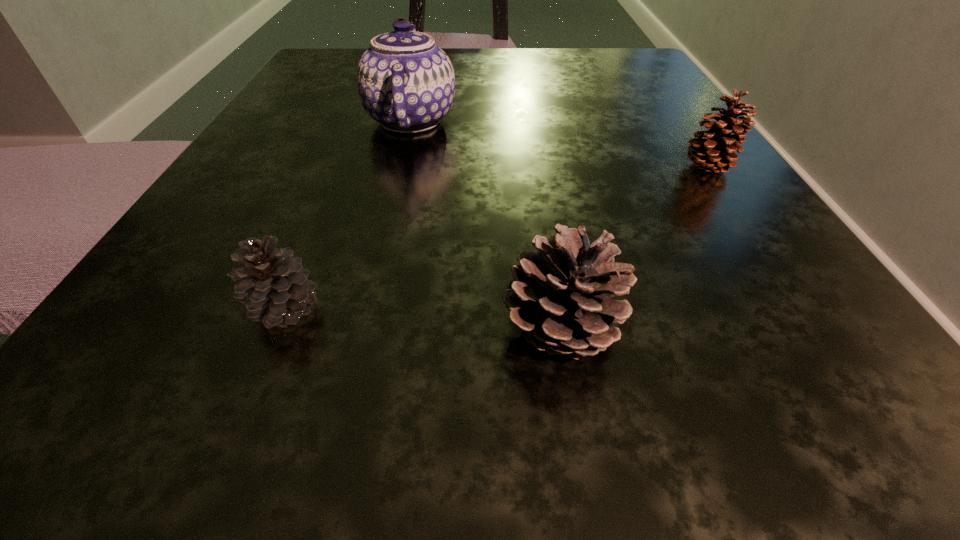
What are the coordinates of `object that is at the far edge` in the screenshot? It's located at (406, 83).

Identify the location of object located at the near edge. Image resolution: width=960 pixels, height=540 pixels. (561, 296).

This screenshot has width=960, height=540. Find the location of `chinaware positioned at the left edge`. chinaware positioned at the left edge is located at coordinates (406, 83).

Find the location of a particular element. The width and height of the screenshot is (960, 540). pinecone that is at the left edge is located at coordinates [274, 287].

Identify the location of object present at the right edge. The height and width of the screenshot is (540, 960). (717, 153).

The image size is (960, 540). I want to click on object that is at the far left corner, so point(406,83).

Locate an element on the screen. vacant space at the far edge of the desktop is located at coordinates tap(473, 74).

Image resolution: width=960 pixels, height=540 pixels. In the image, there is a desktop. Identify the location of vacant area at the near edge. (475, 392).

Locate an element on the screen. This screenshot has width=960, height=540. vacant area at the left edge is located at coordinates (310, 137).

Find the location of a particular element. This screenshot has height=540, width=960. free location at the right edge is located at coordinates (662, 191).